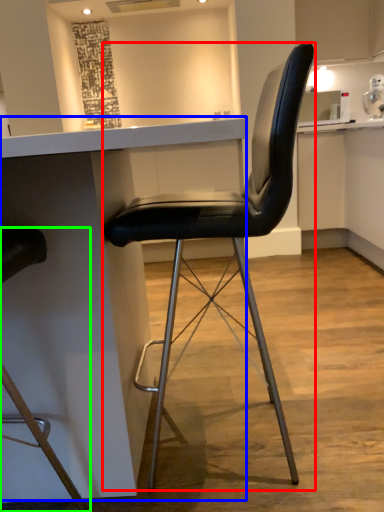
Question: Considering the real-world distances, which object is farthest from chair (highlighted by a red box)? table (highlighted by a blue box) or chair (highlighted by a green box)?

Choices:
 (A) table
 (B) chair

Answer: (B)